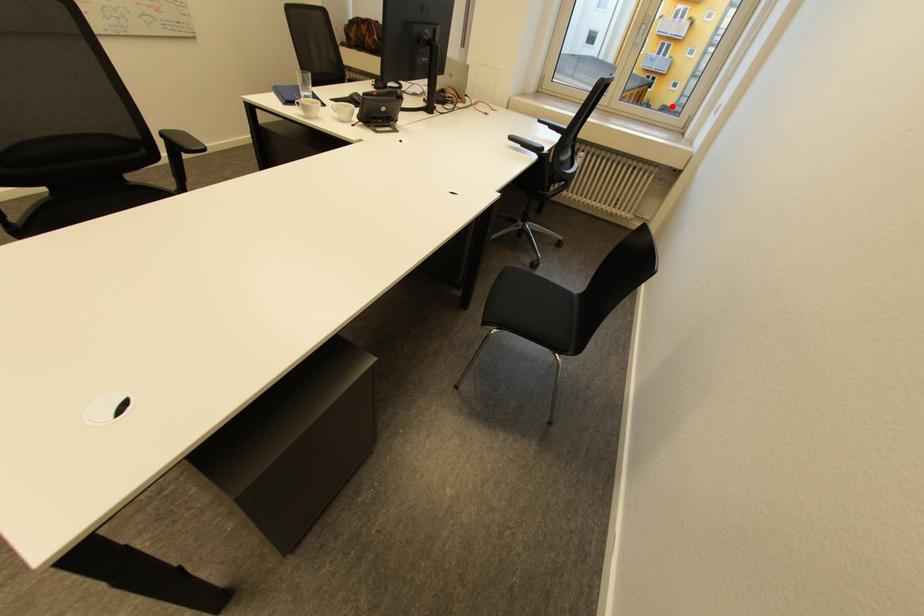
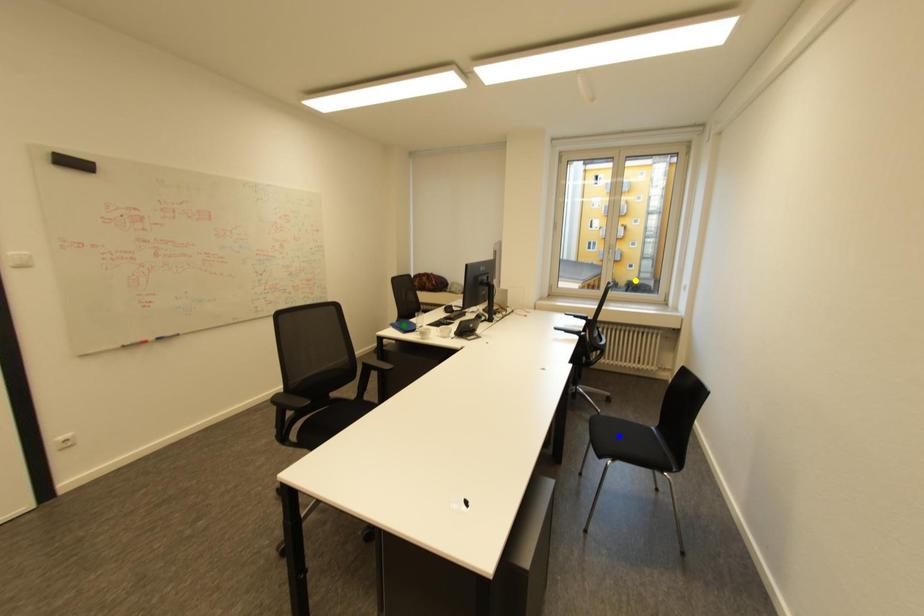
Question: I am providing you with two images of the same scene from different viewpoints. A red point is marked on the first image. You are given multiple points on the second image. In image 2, which mark is for the same physical point as the one in image 1?

Choices:
 (A) blue point
 (B) yellow point
 (C) green point

Answer: (B)